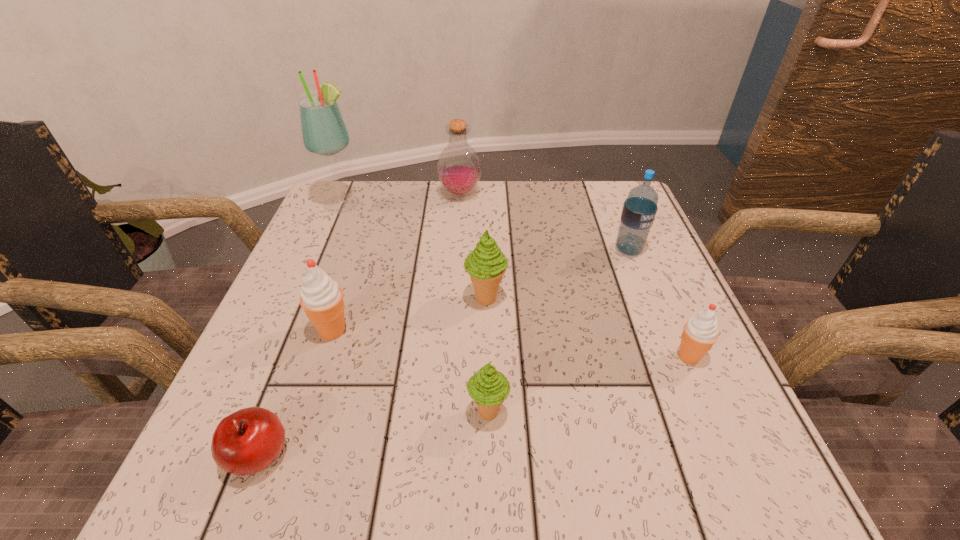
Locate an element on the screen. This screenshot has width=960, height=540. free region located on the back of the nearer green icecream is located at coordinates (486, 259).

Locate an element on the screen. The width and height of the screenshot is (960, 540). vacant space located on the right of the apple is located at coordinates (571, 455).

Identify the location of alcohol that is at the far edge. (324, 132).

Identify the location of bottle that is at the far edge. (458, 168).

The width and height of the screenshot is (960, 540). What are the coordinates of `object that is at the near edge` in the screenshot? It's located at (245, 442).

Find the location of a particular element. The image size is (960, 540). alcohol located at the left edge is located at coordinates (324, 132).

Where is `icecream located in the left edge section of the desktop`? icecream located in the left edge section of the desktop is located at coordinates (321, 297).

Find the location of a particular element. This screenshot has height=540, width=960. apple located at the left edge is located at coordinates (245, 442).

The image size is (960, 540). I want to click on water bottle that is at the right edge, so click(639, 210).

The height and width of the screenshot is (540, 960). Identify the location of icecream positioned at the right edge. [x=700, y=332].